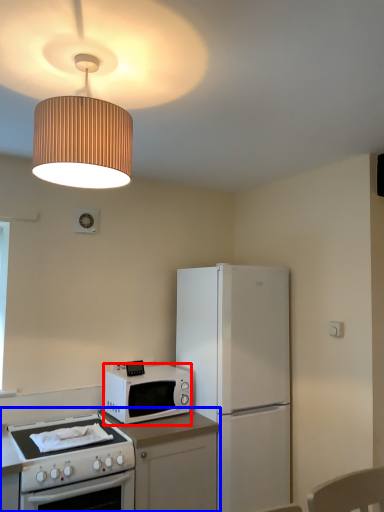
Question: Which point is further to the camera, microwave oven (highlighted by a red box) or countertop (highlighted by a blue box)?

Choices:
 (A) microwave oven
 (B) countertop

Answer: (A)